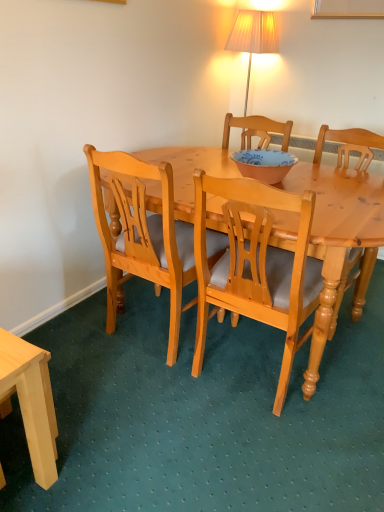
You are a GUI agent. You are given a task and a screenshot of the screen. Output one action in this format:
    pyautogui.click(x=<x>, y=<y>)
    Task: Click on the free spot in front of light brown wood chair at center, the first chair from the left
    The width and height of the screenshot is (384, 512).
    Given the screenshot: What is the action you would take?
    pyautogui.click(x=148, y=400)